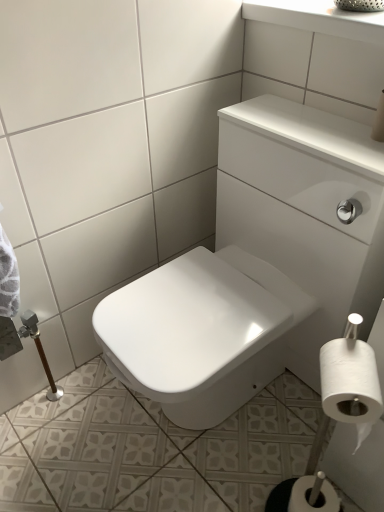
Question: Does white glossy sink at upper center appear on the right side of white matte toilet paper at lower right, the 1th toilet paper from the back?

Choices:
 (A) yes
 (B) no

Answer: (B)

Question: From the image's perspective, is white glossy sink at upper center located above white matte toilet paper at lower right, which appears as the first toilet paper when ordered from the bottom?

Choices:
 (A) yes
 (B) no

Answer: (A)

Question: Considering the relative sizes of white glossy sink at upper center and white matte toilet paper at lower right, the 1th toilet paper from the back, in the image provided, is white glossy sink at upper center taller than white matte toilet paper at lower right, the 1th toilet paper from the back,?

Choices:
 (A) no
 (B) yes

Answer: (B)

Question: From the image's perspective, is white glossy sink at upper center located beneath white matte toilet paper at lower right, which appears as the first toilet paper when ordered from the bottom?

Choices:
 (A) no
 (B) yes

Answer: (A)

Question: Would you say white glossy sink at upper center is outside white matte toilet paper at lower right, the 1th toilet paper from the back?

Choices:
 (A) no
 (B) yes

Answer: (B)

Question: Is white matte toilet paper at lower right, which appears as the first toilet paper when ordered from the bottom, wider or thinner than white matte toilet paper at lower right, acting as the 2th toilet paper starting from the bottom?

Choices:
 (A) wide
 (B) thin

Answer: (A)

Question: Is white matte toilet paper at lower right, positioned as the second toilet paper in front-to-back order, in front of or behind white matte toilet paper at lower right, which is the second toilet paper in back-to-front order, in the image?

Choices:
 (A) front
 (B) behind

Answer: (B)

Question: From a real-world perspective, is white matte toilet paper at lower right, which appears as the first toilet paper when ordered from the bottom, physically located above or below white matte toilet paper at lower right, which ranks as the first toilet paper in front-to-back order?

Choices:
 (A) above
 (B) below

Answer: (B)

Question: Is point (x=296, y=508) positioned closer to the camera than point (x=322, y=410)?

Choices:
 (A) farther
 (B) closer

Answer: (A)

Question: In the image, is white glossy sink at upper center positioned in front of or behind white matte toilet paper at lower right, arranged as the second toilet paper when viewed from the top?

Choices:
 (A) behind
 (B) front

Answer: (B)

Question: Based on their sizes in the image, would you say white glossy sink at upper center is bigger or smaller than white matte toilet paper at lower right, arranged as the second toilet paper when viewed from the top?

Choices:
 (A) small
 (B) big

Answer: (B)

Question: From the image's perspective, is white glossy sink at upper center located above or below white matte toilet paper at lower right, positioned as the second toilet paper in front-to-back order?

Choices:
 (A) above
 (B) below

Answer: (A)

Question: Considering the positions of white glossy sink at upper center and white matte toilet paper at lower right, positioned as the second toilet paper in front-to-back order, in the image, is white glossy sink at upper center wider or thinner than white matte toilet paper at lower right, positioned as the second toilet paper in front-to-back order,?

Choices:
 (A) wide
 (B) thin

Answer: (A)

Question: Is point (332, 510) positioned closer to the camera than point (327, 304)?

Choices:
 (A) closer
 (B) farther

Answer: (A)

Question: From a real-world perspective, is white matte toilet paper at lower right, which appears as the first toilet paper when ordered from the bottom, positioned above or below white glossy sink at upper center?

Choices:
 (A) below
 (B) above

Answer: (A)